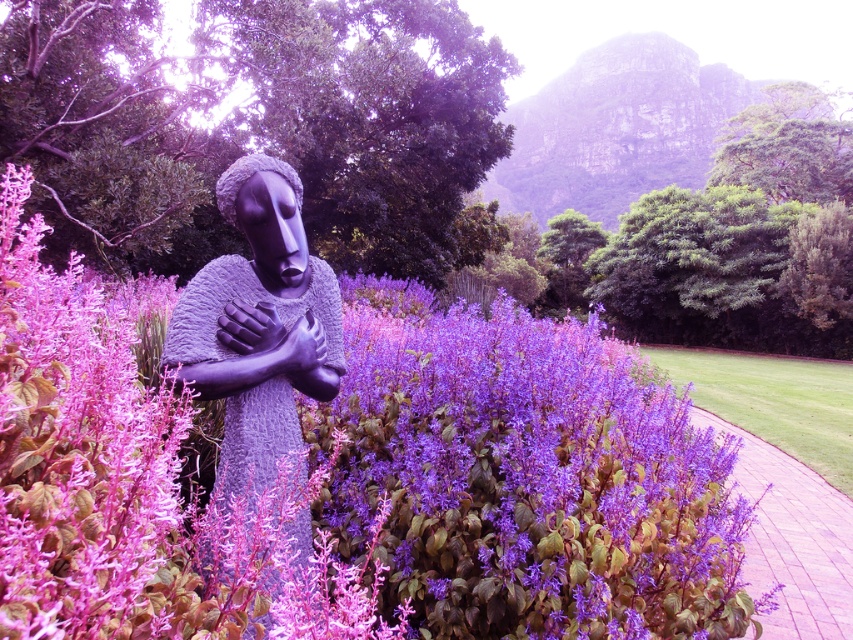
Question: Which of these objects is positioned farthest from the matte black hand at center?

Choices:
 (A) matte gray hand at center
 (B) purple matte flower at center
 (C) matte black statue at center

Answer: (B)

Question: Which object appears farthest from the camera in this image?

Choices:
 (A) matte gray hand at center
 (B) matte black hand at center

Answer: (B)

Question: Does matte gray hand at center have a lesser width compared to matte black hand at center?

Choices:
 (A) no
 (B) yes

Answer: (A)

Question: Is matte gray hand at center thinner than matte black hand at center?

Choices:
 (A) yes
 (B) no

Answer: (B)

Question: Is purple matte flower at center above matte black statue at center?

Choices:
 (A) yes
 (B) no

Answer: (B)

Question: Which point is farther to the camera?

Choices:
 (A) click(260, 204)
 (B) click(292, 358)
 (C) click(57, 340)

Answer: (A)